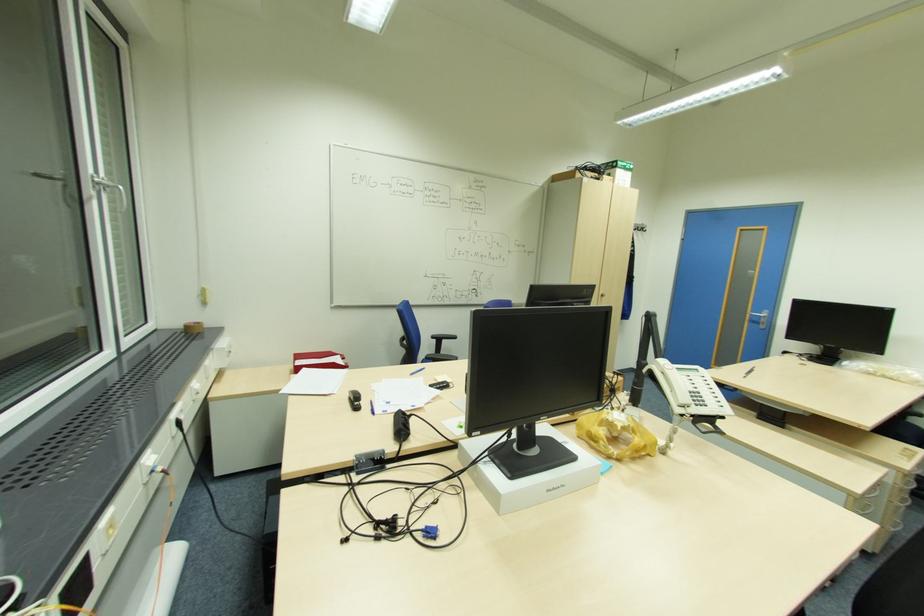
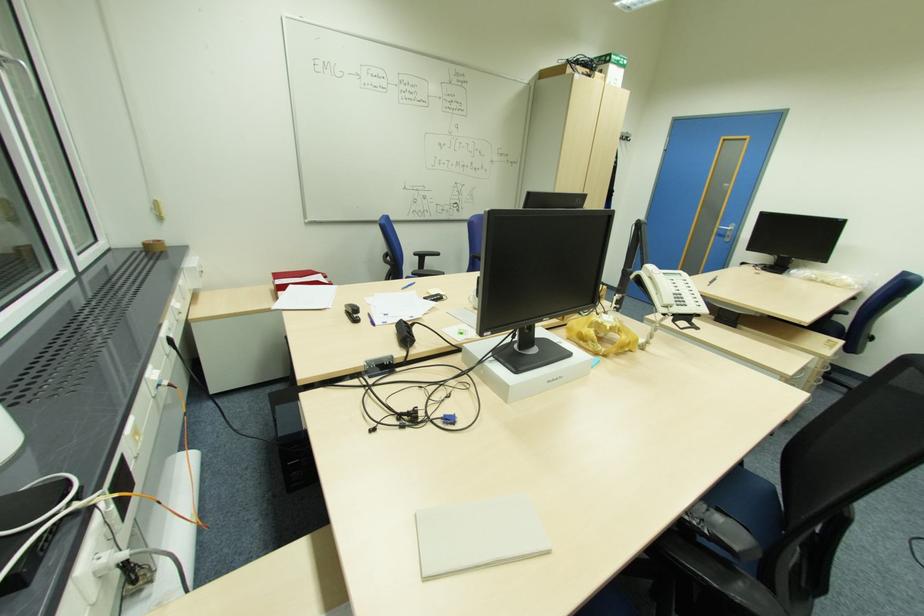
Where in the second image is the point corresponding to [555,488] from the first image?

(555, 379)